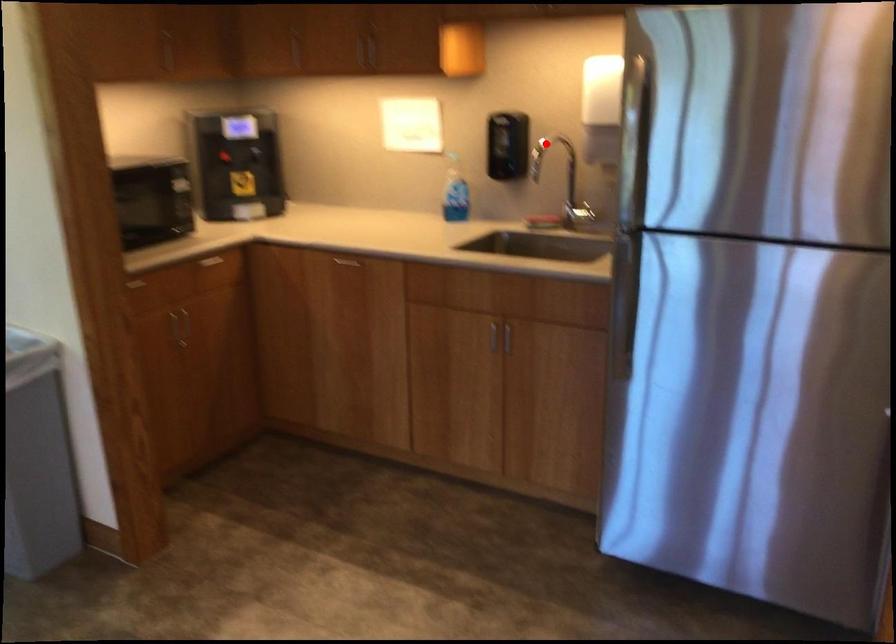
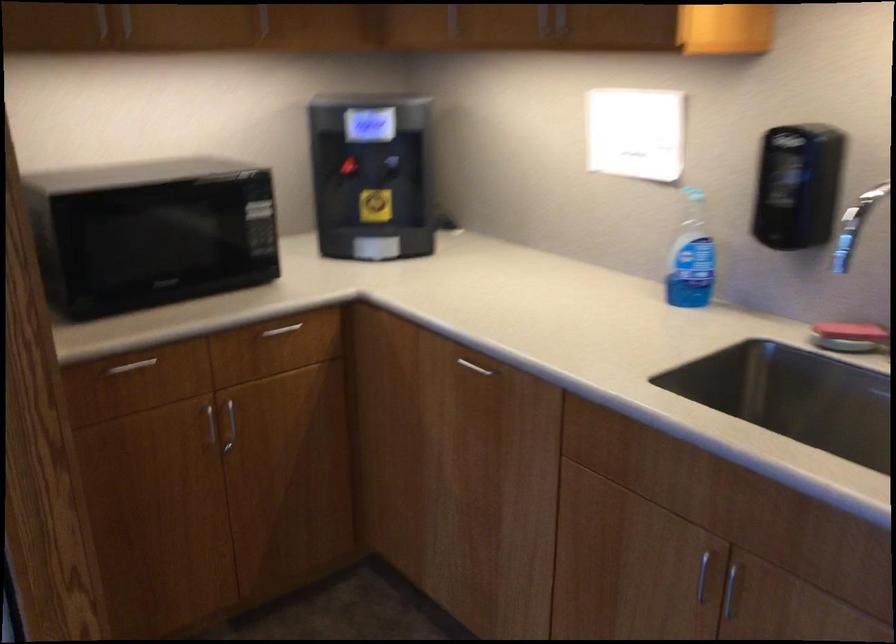
Where in the second image is the point corresponding to the highlighted location from the first image?

(867, 200)